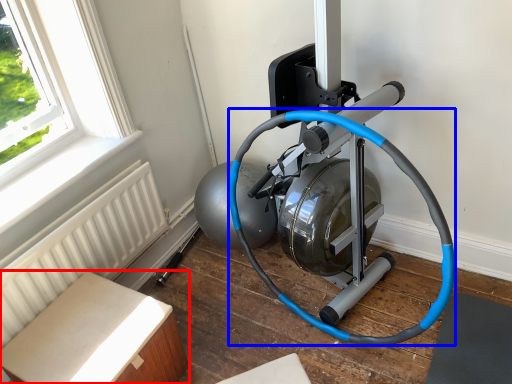
Question: Which object appears farthest to the camera in this image, furniture (highlighted by a red box) or garden hose (highlighted by a blue box)?

Choices:
 (A) furniture
 (B) garden hose

Answer: (A)